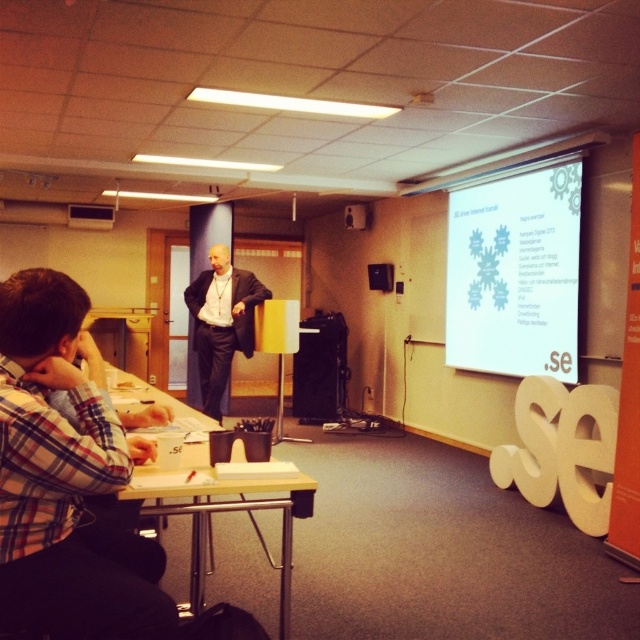
Question: Based on their relative distances, which object is farther from the wooden table at lower left?

Choices:
 (A) plaid shirt at lower left
 (B) white matte projection screen at upper right
 (C) black plastic projector at upper center
 (D) black suit at center

Answer: (C)

Question: Which is nearer to the wooden table at lower left?

Choices:
 (A) black suit at center
 (B) white matte projection screen at upper right
 (C) black plastic projector at upper center
 (D) plaid shirt at lower left

Answer: (D)

Question: Among these points, which one is farthest from the camera?

Choices:
 (A) (92, 205)
 (B) (573, 216)
 (C) (250, 289)
 (D) (120, 497)

Answer: (A)

Question: Does white matte projection screen at upper right appear on the right side of wooden table at lower left?

Choices:
 (A) yes
 (B) no

Answer: (A)

Question: Is plaid shirt at lower left further to the viewer compared to white matte projection screen at upper right?

Choices:
 (A) no
 (B) yes

Answer: (A)

Question: Is white matte projection screen at upper right thinner than wooden table at lower left?

Choices:
 (A) no
 (B) yes

Answer: (B)